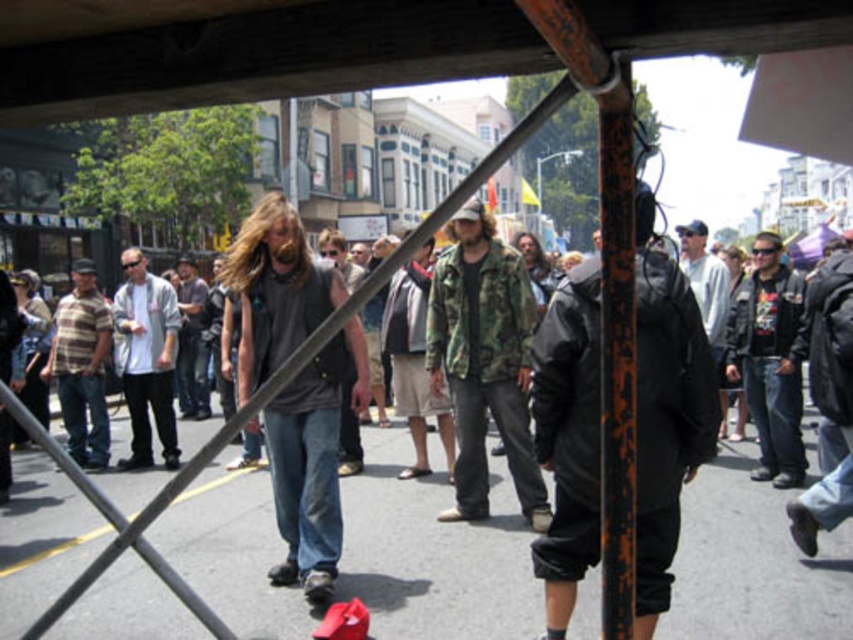
You are organizing a photo shoot and need to ensure that the dark gray fabric shirt at center and the rusty metal pole at center do not overlap in the final image. Based on their widths, can you position the camera so that they are side by side without overlapping?

The dark gray fabric shirt at center might be wider than the rusty metal pole at center. Therefore, positioning the camera to place them side by side may require sufficient space between them to accommodate their widths, especially if the shirt is indeed wider.

You are a photographer trying to capture a photo of the dark gray fabric shirt at center and the rusty metal pole at center. Which object should you focus on first if you want to ensure both are in the frame without moving the camera?

The dark gray fabric shirt at center is larger in size than the rusty metal pole at center, so you should focus on the larger object first to ensure it fits within the frame.